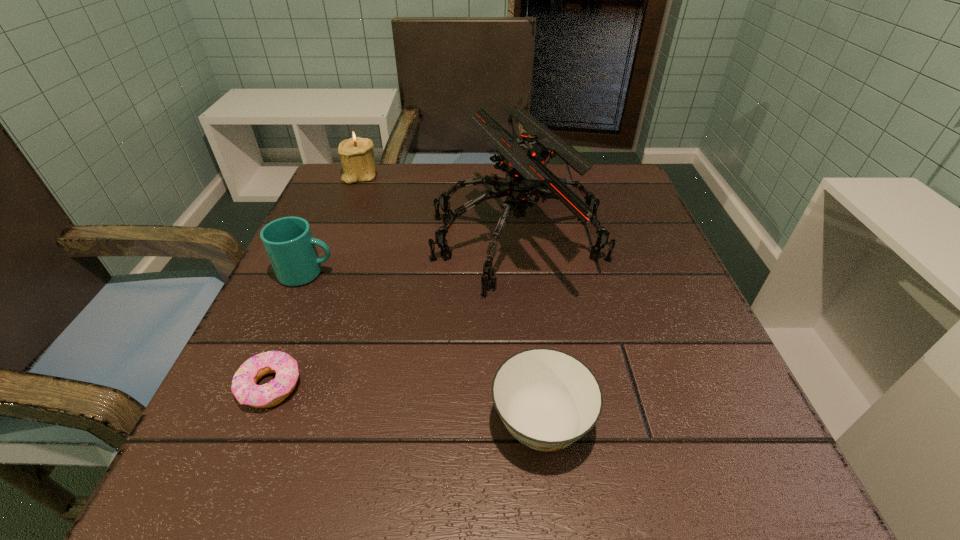
Identify the location of empty space between the fourth tallest object and the third tallest object. Image resolution: width=960 pixels, height=540 pixels. (424, 348).

I want to click on free spot between the cup and the drone, so click(413, 256).

Locate an element on the screen. empty space between the doughnut and the farthest object is located at coordinates (316, 281).

The width and height of the screenshot is (960, 540). Find the location of `vacant space that is in between the farthest object and the soup bowl`. vacant space that is in between the farthest object and the soup bowl is located at coordinates (451, 299).

You are a GUI agent. You are given a task and a screenshot of the screen. Output one action in this format:
    pyautogui.click(x=<x>, y=<y>)
    Task: Click on the unoccupied position between the cup and the soup bowl
    
    Given the screenshot: What is the action you would take?
    pyautogui.click(x=424, y=348)

This screenshot has height=540, width=960. Find the location of `free spot between the candle_holder and the drone`. free spot between the candle_holder and the drone is located at coordinates (440, 207).

Locate an element on the screen. This screenshot has height=540, width=960. object that is the fourth closest to the shortest object is located at coordinates (356, 154).

Identify the location of the fourth closest object to the third tallest object. The image size is (960, 540). (548, 399).

Where is `free space that satisfies the following two spatial constraints: 1. on the front side of the farthest object; 2. on the right side of the soup bowl`? free space that satisfies the following two spatial constraints: 1. on the front side of the farthest object; 2. on the right side of the soup bowl is located at coordinates (262, 423).

Where is `free space that satisfies the following two spatial constraints: 1. on the handle side of the cup; 2. on the left side of the soup bowl`? This screenshot has width=960, height=540. free space that satisfies the following two spatial constraints: 1. on the handle side of the cup; 2. on the left side of the soup bowl is located at coordinates (242, 423).